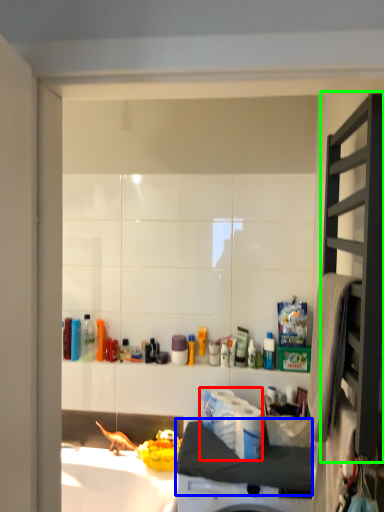
Question: Estimate the real-world distances between objects in this image. Which object is closer to toilet paper (highlighted by a red box), counter top (highlighted by a blue box) or shelf (highlighted by a green box)?

Choices:
 (A) counter top
 (B) shelf

Answer: (A)